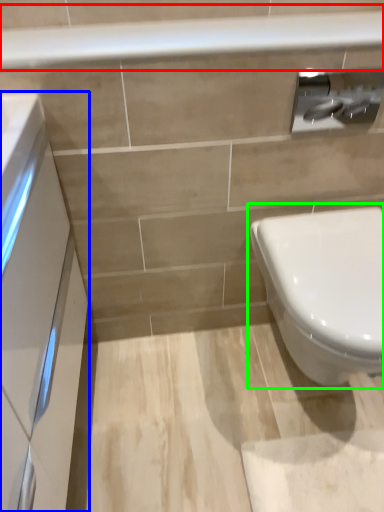
Question: Considering the real-world distances, which object is farthest from balustrade (highlighted by a red box)? porcelain (highlighted by a blue box) or toilet (highlighted by a green box)?

Choices:
 (A) porcelain
 (B) toilet

Answer: (B)